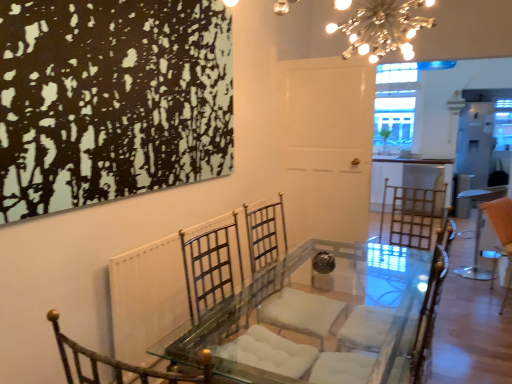
Measure the distance between point (385, 284) and camera.

A distance of 2.81 meters exists between point (385, 284) and camera.

In order to face orange fabric stool at right, should I rotate leftwards or rightwards?

A 27.856 degree turn to the right will do.

Describe the element at coordinates (502, 234) in the screenshot. I see `orange fabric swivel chair at right` at that location.

Identify the location of orange fabric swivel chair at right. (502, 234).

You are a GUI agent. You are given a task and a screenshot of the screen. Output one action in this format:
    pyautogui.click(x=<x>, y=<y>)
    Task: Click on the metallic chandelier at upper center
    This screenshot has height=384, width=512.
    Given the screenshot: What is the action you would take?
    pyautogui.click(x=383, y=28)

In order to face metallic chandelier at upper center, should I rotate leftwards or rightwards?

Turn right by 16.003 degrees to look at metallic chandelier at upper center.

In order to click on metallic gold armchair at center in this screenshot , I will do `click(398, 311)`.

Considering the sizes of objects metallic radiator at center and metallic chandelier at upper center in the image provided, who is shorter, metallic radiator at center or metallic chandelier at upper center?

Standing shorter between the two is metallic chandelier at upper center.

Is metallic radiator at center bigger or smaller than metallic chandelier at upper center?

In the image, metallic radiator at center appears to be larger than metallic chandelier at upper center.

From the image's perspective, is metallic radiator at center on metallic chandelier at upper center?

No, from the image's perspective, metallic radiator at center is not over metallic chandelier at upper center.

In the scene shown: Does metallic radiator at center touch metallic chandelier at upper center?

No, metallic radiator at center is not making contact with metallic chandelier at upper center.

Considering the relative positions of orange fabric stool at right and metallic gold armchair at center in the image provided, is orange fabric stool at right to the left or to the right of metallic gold armchair at center?

Based on their positions, orange fabric stool at right is located to the right of metallic gold armchair at center.

Is orange fabric stool at right taller than metallic gold armchair at center?

Incorrect, the height of orange fabric stool at right is not larger of that of metallic gold armchair at center.

Where is `round table above the metallic gold armchair at center (from the image's perspective)`? This screenshot has height=384, width=512. round table above the metallic gold armchair at center (from the image's perspective) is located at coordinates pos(479,230).

Is clear glass window at upper center a part of metallic chandelier at upper center?

No, clear glass window at upper center is not a part of metallic chandelier at upper center.

Can you confirm if metallic chandelier at upper center is bigger than clear glass window at upper center?

Incorrect, metallic chandelier at upper center is not larger than clear glass window at upper center.

Is metallic chandelier at upper center thinner than clear glass window at upper center?

No, metallic chandelier at upper center is not thinner than clear glass window at upper center.

Can you confirm if metallic chandelier at upper center is taller than metallic radiator at center?

In fact, metallic chandelier at upper center may be shorter than metallic radiator at center.

Based on the photo, is metallic chandelier at upper center positioned beyond the bounds of metallic radiator at center?

Absolutely, metallic chandelier at upper center is external to metallic radiator at center.

Considering the sizes of objects metallic chandelier at upper center and metallic radiator at center in the image provided, who is thinner, metallic chandelier at upper center or metallic radiator at center?

metallic radiator at center is thinner.

Considering the positions of objects clear glass window at upper center and metallic gold armchair at center in the image provided, who is behind, clear glass window at upper center or metallic gold armchair at center?

clear glass window at upper center.

Where is `window above the metallic gold armchair at center (from the image's perspective)`? window above the metallic gold armchair at center (from the image's perspective) is located at coordinates (395, 106).

In the scene shown: Is clear glass window at upper center positioned with its back to metallic gold armchair at center?

No.

Based on the photo, from a real-world perspective, who is located lower, clear glass window at upper center or metallic gold armchair at center?

In real-world perspective, metallic gold armchair at center is lower.

In terms of width, does metallic gold armchair at center look wider or thinner when compared to clear glass window at upper center?

metallic gold armchair at center is wider than clear glass window at upper center.

In terms of height, does metallic gold armchair at center look taller or shorter compared to clear glass window at upper center?

Clearly, metallic gold armchair at center is shorter compared to clear glass window at upper center.

The image size is (512, 384). I want to click on armchair below the clear glass window at upper center (from a real-world perspective), so click(x=398, y=311).

Which is closer, (448,234) or (187,347)?

The point (187,347) is closer to the camera.

What's the angular difference between metallic gold armchair at center and metallic radiator at center's facing directions?

4.64 degrees separate the facing orientations of metallic gold armchair at center and metallic radiator at center.

The width and height of the screenshot is (512, 384). In order to click on armchair below the metallic radiator at center (from a real-world perspective) in this screenshot , I will do `click(398, 311)`.

Is metallic gold armchair at center positioned with its back to metallic radiator at center?

metallic gold armchair at center does not have its back to metallic radiator at center.

Locate an element on the screen. radiator that is on the left side of metallic chandelier at upper center is located at coordinates point(148,297).

This screenshot has height=384, width=512. I want to click on armchair in front of the orange fabric stool at right, so click(398, 311).

In the scene shown: Based on their spatial positions, is metallic chandelier at upper center or orange fabric stool at right closer to clear glass window at upper center?

Based on the image, orange fabric stool at right appears to be nearer to clear glass window at upper center.

Estimate the real-world distances between objects in this image. Which object is closer to clear glass window at upper center, metallic gold armchair at center or metallic chandelier at upper center?

metallic chandelier at upper center is closer to clear glass window at upper center.

Looking at the image, which one is located closer to metallic radiator at center, orange fabric stool at right or orange fabric swivel chair at right?

orange fabric swivel chair at right is positioned closer to the anchor metallic radiator at center.

Looking at the image, which one is located closer to metallic radiator at center, metallic chandelier at upper center or orange fabric stool at right?

metallic chandelier at upper center is positioned closer to the anchor metallic radiator at center.

Looking at the image, which one is located further to metallic gold armchair at center, orange fabric stool at right or metallic radiator at center?

The object further to metallic gold armchair at center is orange fabric stool at right.

Estimate the real-world distances between objects in this image. Which object is closer to metallic chandelier at upper center, metallic gold armchair at center or metallic radiator at center?

metallic gold armchair at center lies closer to metallic chandelier at upper center than the other object.

Based on the photo, looking at the image, which one is located closer to orange fabric swivel chair at right, metallic chandelier at upper center or metallic gold armchair at center?

metallic gold armchair at center is closer to orange fabric swivel chair at right.

Estimate the real-world distances between objects in this image. Which object is closer to metallic gold armchair at center, metallic radiator at center or orange fabric swivel chair at right?

metallic radiator at center is positioned closer to the anchor metallic gold armchair at center.

Where is `light fixture positioned between metallic radiator at center and orange fabric stool at right from near to far`? light fixture positioned between metallic radiator at center and orange fabric stool at right from near to far is located at coordinates (383, 28).

The width and height of the screenshot is (512, 384). What are the coordinates of `swivel chair situated between metallic radiator at center and orange fabric stool at right from left to right` in the screenshot? It's located at (502, 234).

This screenshot has width=512, height=384. I want to click on armchair located between metallic radiator at center and orange fabric stool at right in the depth direction, so click(x=398, y=311).

At what (x,y) coordinates should I click in order to perform the action: click on light fixture situated between metallic radiator at center and orange fabric swivel chair at right from left to right. Please return your answer as a coordinate pair (x, y). This screenshot has width=512, height=384. Looking at the image, I should click on (383, 28).